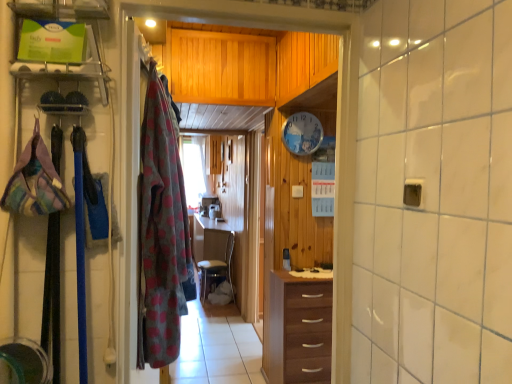
Image resolution: width=512 pixels, height=384 pixels. Identify the location of free space above brown wood chest of drawers at center (from a real-world perspective). (308, 272).